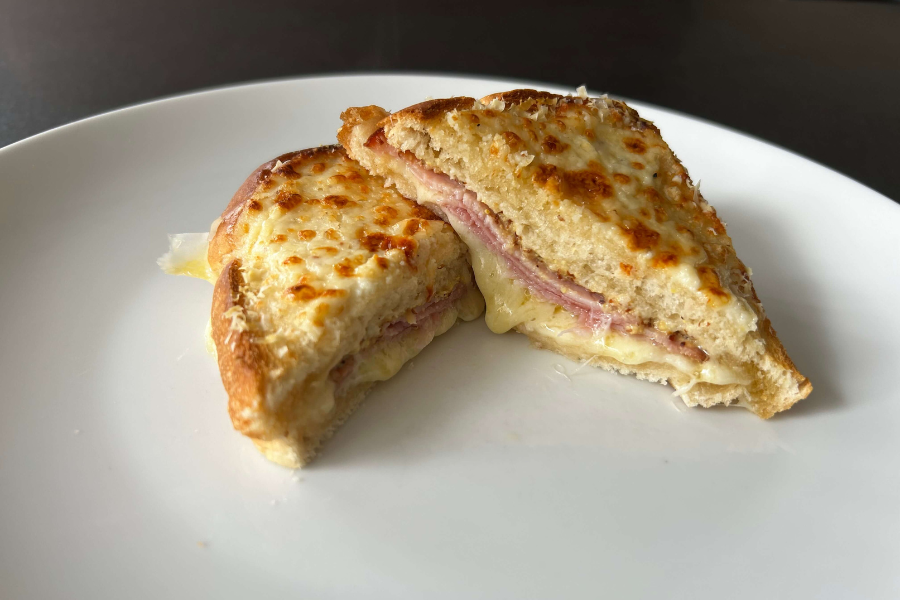
Identify the location of edge og plate. (424, 74).